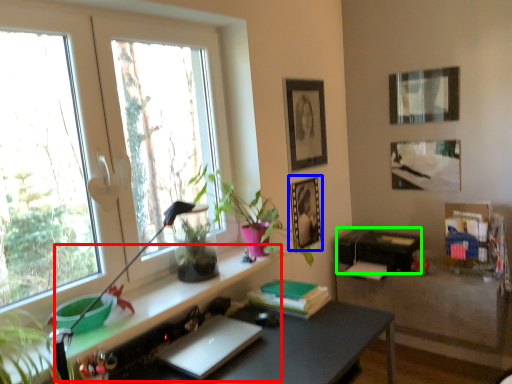
Question: Estimate the real-world distances between objects in this image. Which object is farther from shelf (highlighted by a red box), picture frame (highlighted by a blue box) or printer (highlighted by a green box)?

Choices:
 (A) picture frame
 (B) printer

Answer: (B)